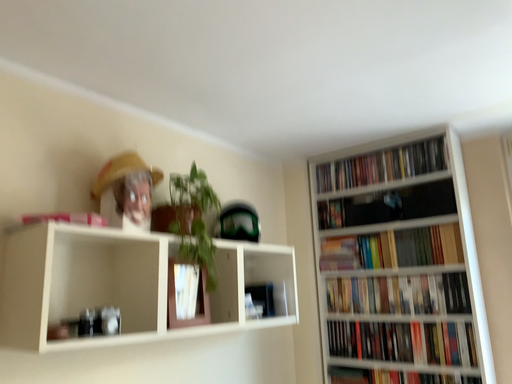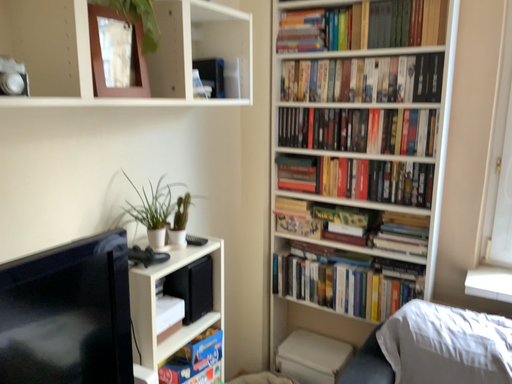
Question: Which way did the camera rotate in the video?

Choices:
 (A) rotated right
 (B) rotated left

Answer: (A)